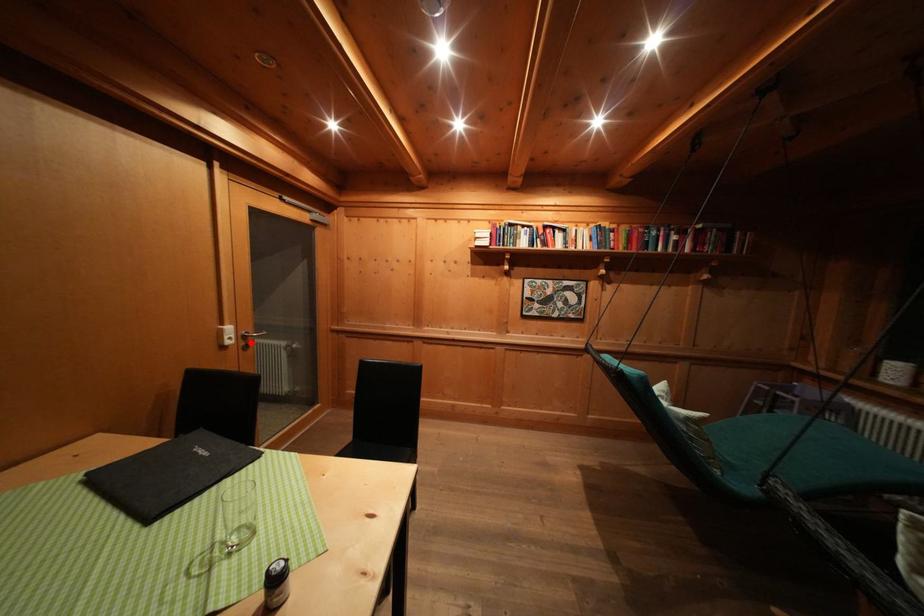
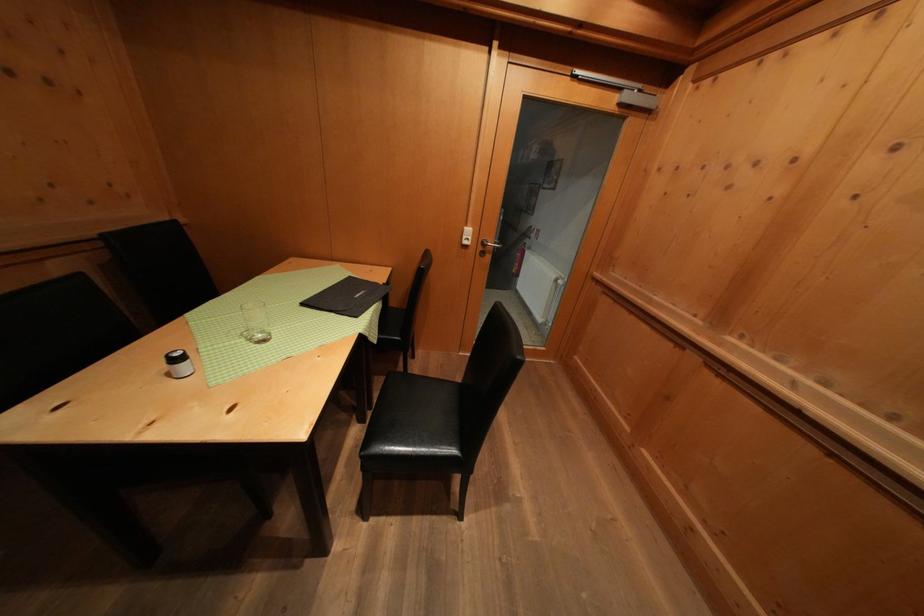
Question: I am providing you with two images of the same scene from different viewpoints. Image1 has a red point marked. In image2, the corresponding 3D location appears at what relative position? Reply with the corresponding letter.

Choices:
 (A) Closer
 (B) Farther

Answer: (B)